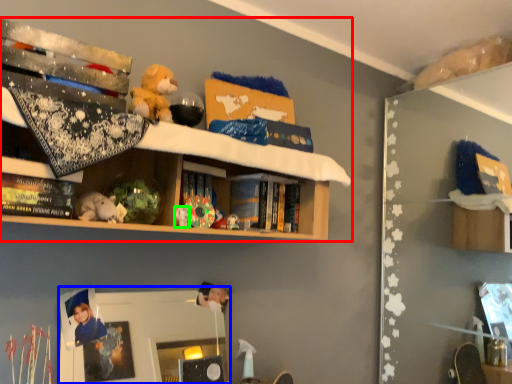
Question: Which is nearer to the shelf (highlighted by a red box)? mirror (highlighted by a blue box) or toy (highlighted by a green box).

Choices:
 (A) mirror
 (B) toy

Answer: (B)